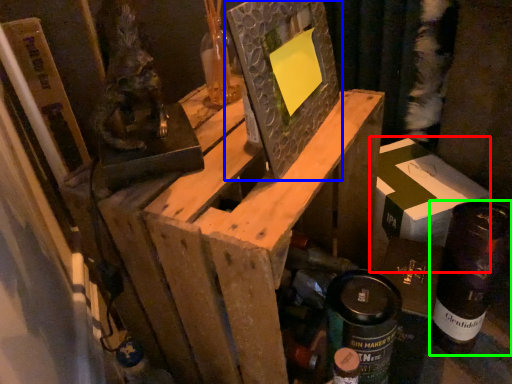
Question: Which is farther away from cardboard box (highlighted by a red box)? picture frame (highlighted by a blue box) or bottle (highlighted by a green box)?

Choices:
 (A) picture frame
 (B) bottle

Answer: (A)